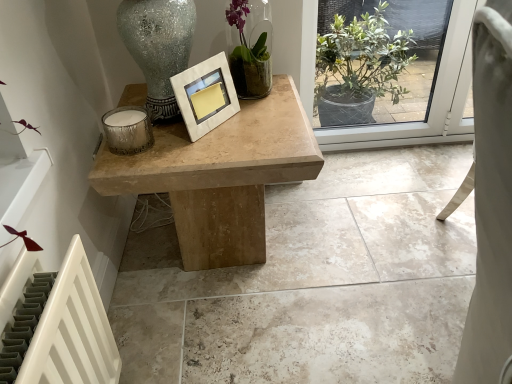
Find the location of a particular element. vacant space to the right of metallic textured candle at left is located at coordinates (x=188, y=144).